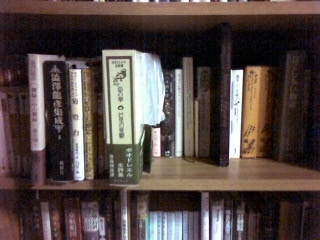
You are a GUI agent. You are given a task and a screenshot of the screen. Output one action in this format:
    pyautogui.click(x=<x>, y=<y>)
    Task: Click on the thick green and cream colored book
    The image size is (320, 240).
    Given the screenshot: What is the action you would take?
    pyautogui.click(x=201, y=148)